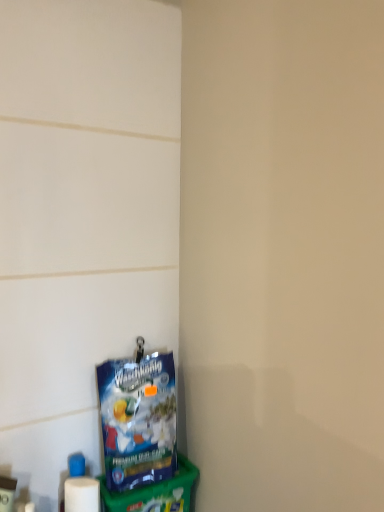
Question: Is white plastic container at lower left bigger than blue plastic bag at lower left?

Choices:
 (A) yes
 (B) no

Answer: (B)

Question: Does white plastic container at lower left have a lesser height compared to blue plastic bag at lower left?

Choices:
 (A) yes
 (B) no

Answer: (A)

Question: Does white plastic container at lower left have a greater width compared to blue plastic bag at lower left?

Choices:
 (A) no
 (B) yes

Answer: (A)

Question: From the image's perspective, would you say white plastic container at lower left is positioned over blue plastic bag at lower left?

Choices:
 (A) yes
 (B) no

Answer: (B)

Question: From the image's perspective, is white plastic container at lower left under blue plastic bag at lower left?

Choices:
 (A) no
 (B) yes

Answer: (B)

Question: Is the depth of white plastic container at lower left greater than that of blue plastic bag at lower left?

Choices:
 (A) no
 (B) yes

Answer: (A)

Question: Is blue plastic bag at lower left positioned with its back to white plastic container at lower left?

Choices:
 (A) yes
 (B) no

Answer: (B)

Question: Is blue plastic bag at lower left surrounding white plastic container at lower left?

Choices:
 (A) yes
 (B) no

Answer: (B)

Question: Considering the relative sizes of blue plastic bag at lower left and white plastic container at lower left in the image provided, is blue plastic bag at lower left thinner than white plastic container at lower left?

Choices:
 (A) no
 (B) yes

Answer: (A)

Question: Is blue plastic bag at lower left aimed at white plastic container at lower left?

Choices:
 (A) yes
 (B) no

Answer: (B)

Question: Is blue plastic bag at lower left placed right next to white plastic container at lower left?

Choices:
 (A) yes
 (B) no

Answer: (B)

Question: Is the position of blue plastic bag at lower left more distant than that of white plastic container at lower left?

Choices:
 (A) yes
 (B) no

Answer: (A)

Question: From the image's perspective, is white plastic container at lower left located above or below blue plastic bag at lower left?

Choices:
 (A) below
 (B) above

Answer: (A)